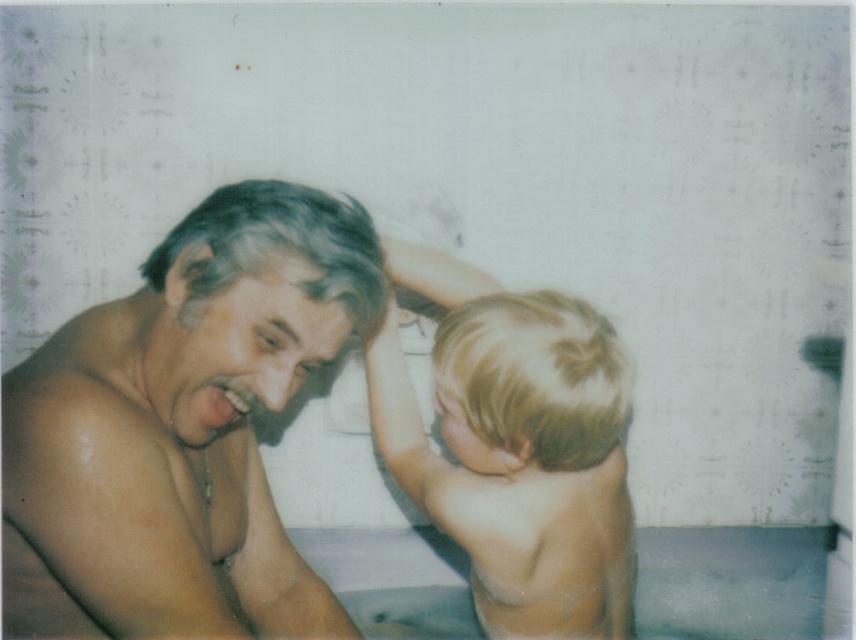
Based on the scene description, where is the smooth skin man at center located in terms of coordinates?

The smooth skin man at center is located at coordinates point (181, 428).

Based on the scene described, which object is positioned higher between the blonde hair at upper right and the white smooth foam at lower center?

The blonde hair at upper right is positioned higher than the white smooth foam at lower center according to the description.